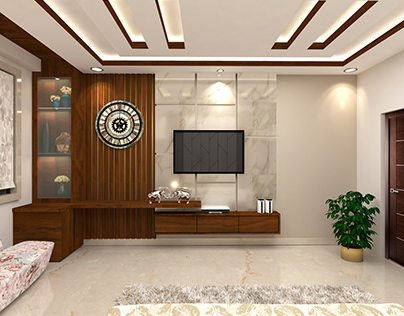
Locate an element on the screen. The image size is (404, 316). planter is located at coordinates (351, 251).